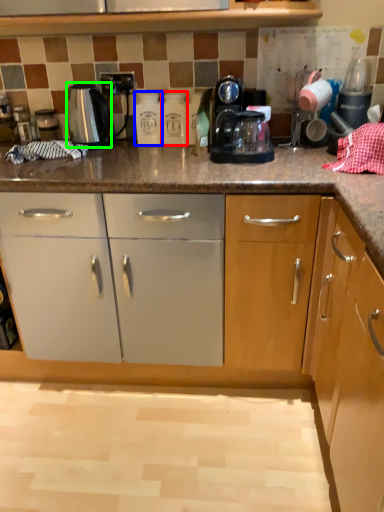
Question: Considering the real-world distances, which object is farthest from bottle (highlighted by a red box)? bottle (highlighted by a blue box) or kitchen appliance (highlighted by a green box)?

Choices:
 (A) bottle
 (B) kitchen appliance

Answer: (B)